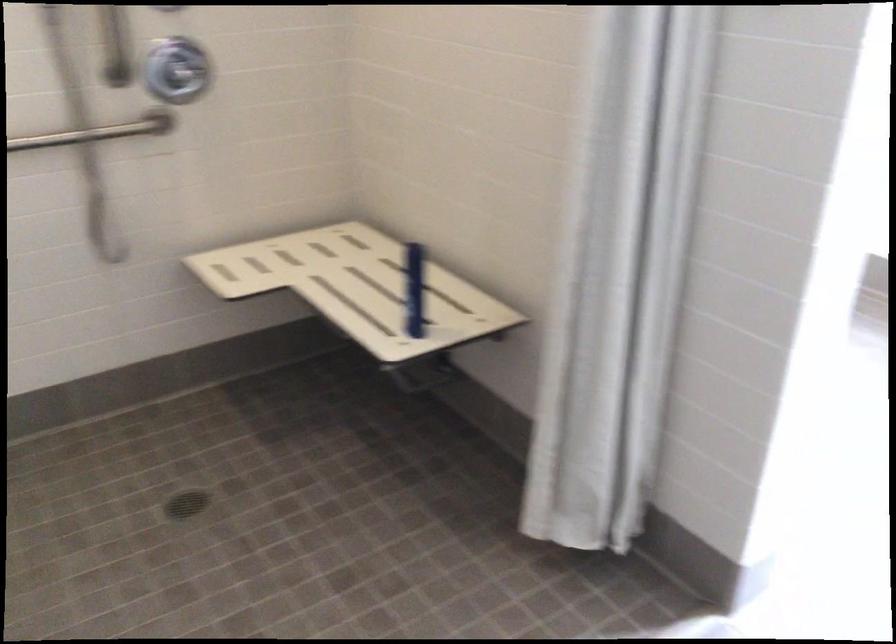
Find the location of a particular element. The image size is (896, 644). metal grab bar is located at coordinates point(98,131).